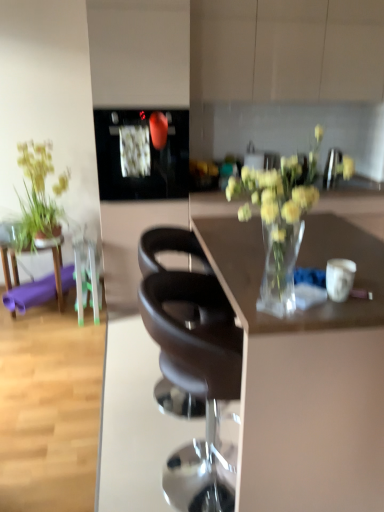
Question: From a real-world perspective, does purple rubber mat at left stand above black glossy microwave at upper center?

Choices:
 (A) no
 (B) yes

Answer: (A)

Question: Is purple rubber mat at left to the left of black glossy microwave at upper center from the viewer's perspective?

Choices:
 (A) yes
 (B) no

Answer: (A)

Question: From the image's perspective, is purple rubber mat at left located above black glossy microwave at upper center?

Choices:
 (A) yes
 (B) no

Answer: (B)

Question: Does purple rubber mat at left have a lesser width compared to black glossy microwave at upper center?

Choices:
 (A) no
 (B) yes

Answer: (B)

Question: Does purple rubber mat at left have a greater width compared to black glossy microwave at upper center?

Choices:
 (A) no
 (B) yes

Answer: (A)

Question: Looking at their shapes, would you say black leather chair at center, the 1th chair when ordered from back to front, is wider or thinner than transparent glass vase at center?

Choices:
 (A) thin
 (B) wide

Answer: (A)

Question: From the image's perspective, is black leather chair at center, the 1th chair when ordered from back to front, located above or below transparent glass vase at center?

Choices:
 (A) below
 (B) above

Answer: (B)

Question: Is black leather chair at center, the 1th chair when ordered from back to front, in front of or behind transparent glass vase at center in the image?

Choices:
 (A) behind
 (B) front

Answer: (A)

Question: In terms of height, does black leather chair at center, the second chair when ordered from front to back, look taller or shorter compared to transparent glass vase at center?

Choices:
 (A) short
 (B) tall

Answer: (A)

Question: From a real-world perspective, is transparent glass vase at center above or below black glossy microwave at upper center?

Choices:
 (A) above
 (B) below

Answer: (B)

Question: In the image, is transparent glass vase at center positioned in front of or behind black glossy microwave at upper center?

Choices:
 (A) behind
 (B) front

Answer: (B)

Question: From the image's perspective, is transparent glass vase at center located above or below black glossy microwave at upper center?

Choices:
 (A) below
 (B) above

Answer: (A)

Question: Does point (297, 421) appear closer or farther from the camera than point (185, 132)?

Choices:
 (A) closer
 (B) farther

Answer: (A)

Question: Is purple rubber mat at left wider or thinner than black glossy microwave at upper center?

Choices:
 (A) thin
 (B) wide

Answer: (A)

Question: Considering the positions of purple rubber mat at left and black glossy microwave at upper center in the image, is purple rubber mat at left taller or shorter than black glossy microwave at upper center?

Choices:
 (A) tall
 (B) short

Answer: (B)